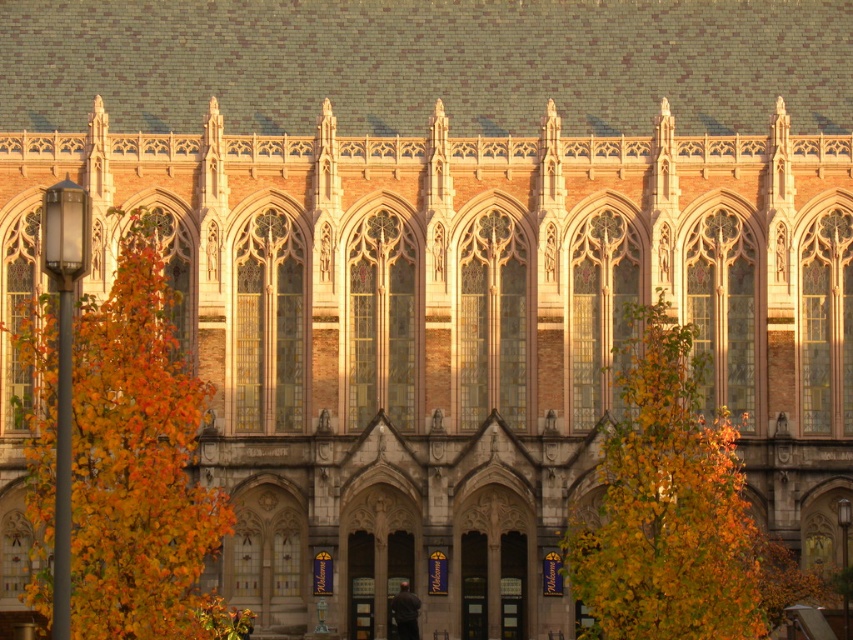
Can you confirm if orange leafy tree at left is positioned to the right of yellow-green leaves at center?

Incorrect, orange leafy tree at left is not on the right side of yellow-green leaves at center.

Is point (142, 216) farther from viewer compared to point (698, 616)?

That is True.

The width and height of the screenshot is (853, 640). What do you see at coordinates (140, 465) in the screenshot?
I see `orange leafy tree at left` at bounding box center [140, 465].

In order to click on orange leafy tree at left in this screenshot , I will do `click(140, 465)`.